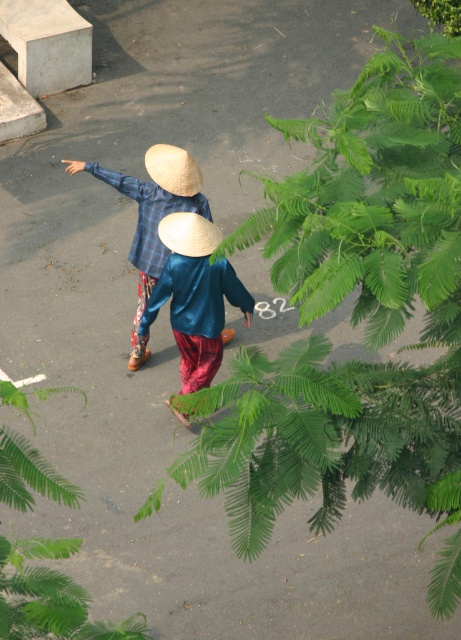
You are a photographer trying to capture the blue silk shirt at center and the green leafy fern at lower left in your shot. Which object would you need to zoom in on more to fill the frame, considering their sizes?

The green leafy fern at lower left is thinner than the blue silk shirt at center, so you would need to zoom in more on the green leafy fern at lower left to fill the frame since it is smaller in size.

You are a photographer trying to capture both the green leafy fern at upper right and the natural straw hat at upper center in the same frame. Based on their sizes, which object should you focus on to ensure both fit clearly in the photo?

Since the green leafy fern at upper right is larger than the natural straw hat at upper center, you should focus on the green leafy fern at upper right to ensure both objects fit clearly in the photo.

You are a photographer trying to capture a clear shot of the green leafy fern at upper right and the natural straw hat at upper center. Since the fern is partially hidden, can you adjust your position to see both objects without obstruction?

The green leafy fern at upper right is positioned under the natural straw hat at upper center, so moving your camera angle slightly upward or to the side might allow you to capture both without obstruction.